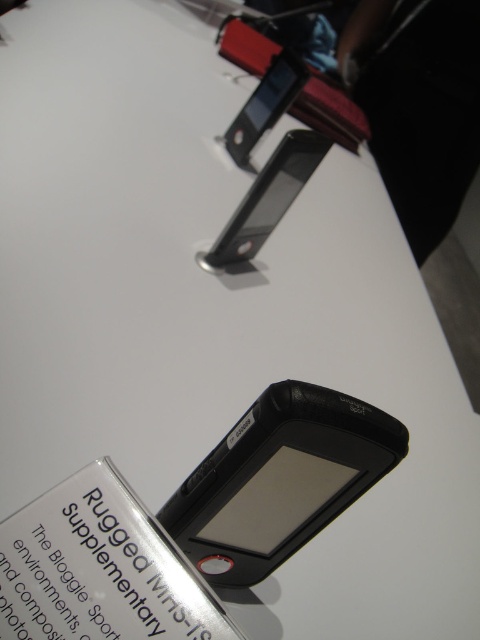
You are a tech reviewer evaluating two devices at a trade show. You notice the black matte gps at center and the matte black phone at upper center on a display table. Which device is taller?

The black matte gps at center is taller than the matte black phone at upper center.

You are at a tech exhibition and want to compare the two devices displayed on the white surface. Which device is taller between the black matte GPS at center and the black matte smartphone at upper center?

The black matte GPS at center is taller than the black matte smartphone at upper center according to the description provided.

You are at a trade show and see two devices labeled as black matte smartphone at upper center and matte black phone at upper center. Which one is closer to you?

The black matte smartphone at upper center is closer because it is in front of the matte black phone at upper center.